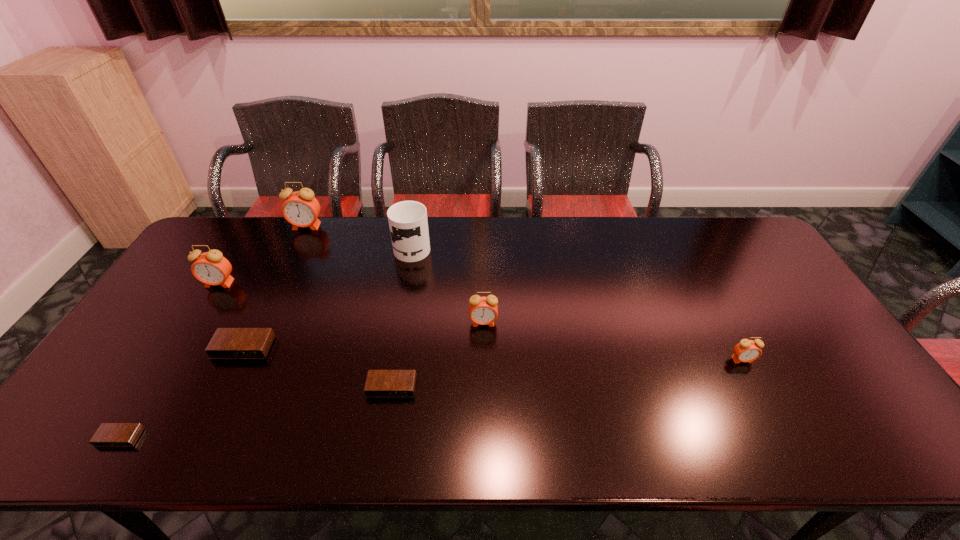
Locate which object is the third closest to the fourth tallest object. Please provide its 2D coordinates. Your answer should be formatted as a tuple, i.e. [(x, y)], where the tuple contains the x and y coordinates of a point satisfying the conditions above.

[(227, 343)]

Locate which object is the sixth closest to the third shortest alarm clock. Please provide its 2D coordinates. Your answer should be formatted as a tuple, i.e. [(x, y)], where the tuple contains the x and y coordinates of a point satisfying the conditions above.

[(482, 310)]

This screenshot has height=540, width=960. Identify the location of alarm clock identified as the closest to the sixth farthest alarm clock. (482, 310).

Identify which alarm clock is the second closest to the shortest object. Please provide its 2D coordinates. Your answer should be formatted as a tuple, i.e. [(x, y)], where the tuple contains the x and y coordinates of a point satisfying the conditions above.

[(211, 268)]

You are a GUI agent. You are given a task and a screenshot of the screen. Output one action in this format:
    pyautogui.click(x=<x>, y=<y>)
    Task: Click on the pink alarm clock that stands as the second closest to the leftmost black alarm clock
    The height and width of the screenshot is (540, 960).
    Given the screenshot: What is the action you would take?
    pyautogui.click(x=301, y=209)

Select which pink alarm clock is the third closest to the farthest pink alarm clock. Please provide its 2D coordinates. Your answer should be formatted as a tuple, i.e. [(x, y)], where the tuple contains the x and y coordinates of a point satisfying the conditions above.

[(747, 350)]

What are the coordinates of `black alarm clock identified as the second closest to the farthest alarm clock` in the screenshot? It's located at (379, 383).

Where is `black alarm clock that is the closest one to the third smallest pink alarm clock`? The width and height of the screenshot is (960, 540). black alarm clock that is the closest one to the third smallest pink alarm clock is located at coordinates (227, 343).